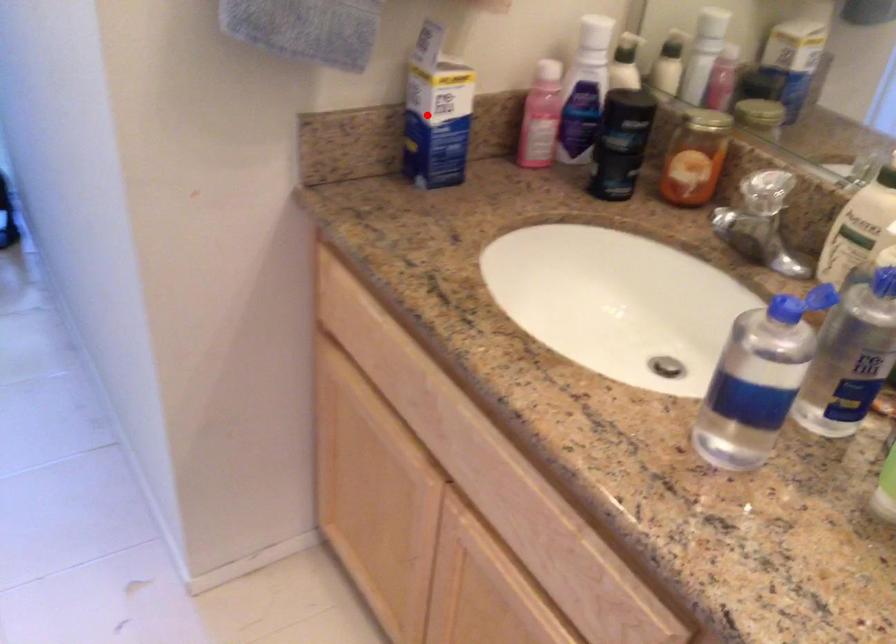
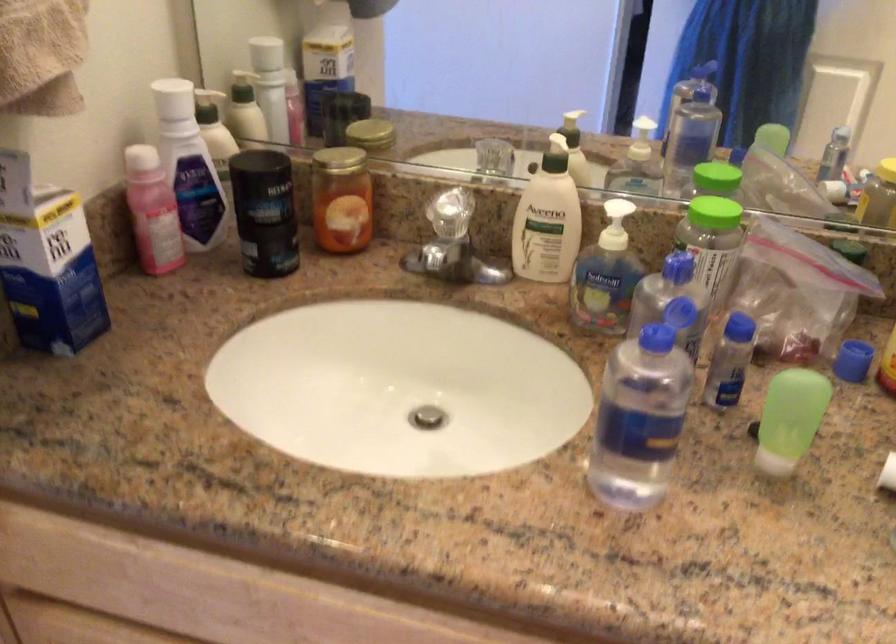
Where in the second image is the point corresponding to the highlighted location from the first image?

(47, 263)